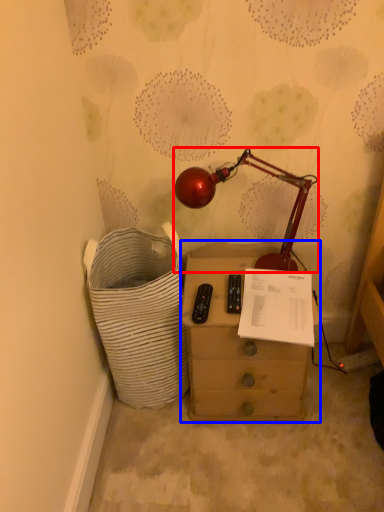
Question: Which object is closer to the camera taking this photo, lamp (highlighted by a red box) or chest of drawers (highlighted by a blue box)?

Choices:
 (A) lamp
 (B) chest of drawers

Answer: (A)